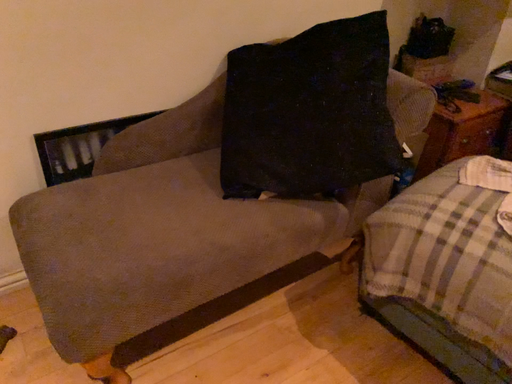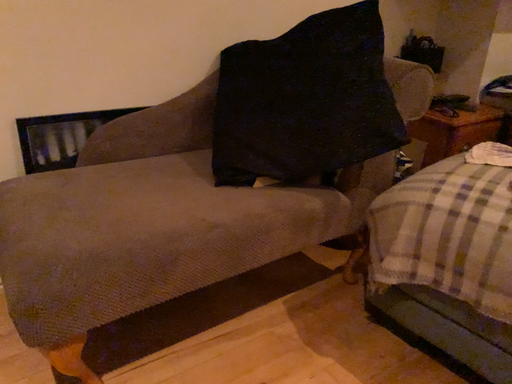
Question: How did the camera likely rotate when shooting the video?

Choices:
 (A) rotated downward
 (B) rotated upward

Answer: (B)